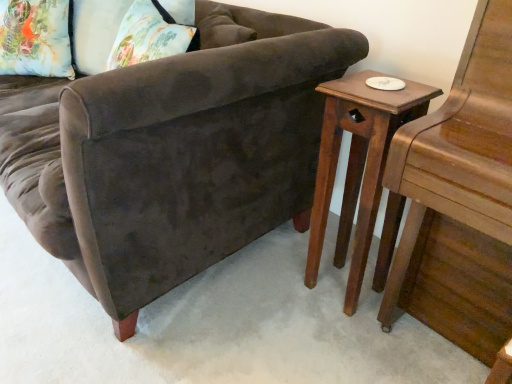
Question: Can you confirm if floral fabric pillow at upper left is thinner than velvet brown couch at center?

Choices:
 (A) yes
 (B) no

Answer: (A)

Question: Is floral fabric pillow at upper left facing towards velvet brown couch at center?

Choices:
 (A) no
 (B) yes

Answer: (B)

Question: Does floral fabric pillow at upper left have a lesser height compared to velvet brown couch at center?

Choices:
 (A) no
 (B) yes

Answer: (B)

Question: Is floral fabric pillow at upper left wider than velvet brown couch at center?

Choices:
 (A) yes
 (B) no

Answer: (B)

Question: Is floral fabric pillow at upper left taller than velvet brown couch at center?

Choices:
 (A) no
 (B) yes

Answer: (A)

Question: Considering their positions, is velvet brown couch at center located in front of or behind wooden side table at right?

Choices:
 (A) behind
 (B) front

Answer: (B)

Question: Considering the positions of point (234, 54) and point (361, 193), is point (234, 54) closer or farther from the camera than point (361, 193)?

Choices:
 (A) farther
 (B) closer

Answer: (B)

Question: Which is correct: velvet brown couch at center is inside wooden side table at right, or outside of it?

Choices:
 (A) outside
 (B) inside

Answer: (A)

Question: From the image's perspective, is velvet brown couch at center above or below wooden side table at right?

Choices:
 (A) below
 (B) above

Answer: (B)

Question: Considering the relative positions of wooden side table at right and floral fabric pillow at upper left in the image provided, is wooden side table at right to the left or to the right of floral fabric pillow at upper left?

Choices:
 (A) right
 (B) left

Answer: (A)

Question: Relative to floral fabric pillow at upper left, is wooden side table at right in front or behind?

Choices:
 (A) front
 (B) behind

Answer: (A)

Question: Considering the positions of wooden side table at right and floral fabric pillow at upper left in the image, is wooden side table at right wider or thinner than floral fabric pillow at upper left?

Choices:
 (A) thin
 (B) wide

Answer: (B)

Question: Is wooden side table at right taller or shorter than floral fabric pillow at upper left?

Choices:
 (A) short
 (B) tall

Answer: (B)

Question: From the image's perspective, is floral fabric pillow at upper left located above or below wooden side table at right?

Choices:
 (A) above
 (B) below

Answer: (A)

Question: Relative to wooden side table at right, is floral fabric pillow at upper left in front or behind?

Choices:
 (A) front
 (B) behind

Answer: (B)